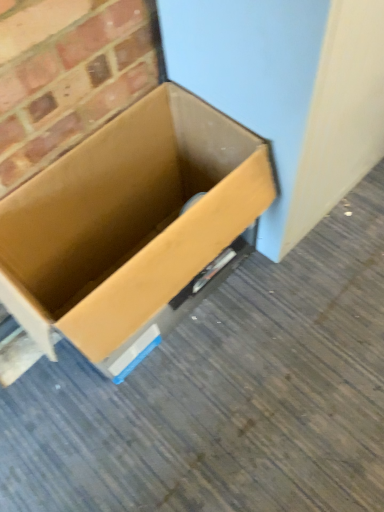
The height and width of the screenshot is (512, 384). What do you see at coordinates (129, 227) in the screenshot?
I see `brown cardboard box at center` at bounding box center [129, 227].

The image size is (384, 512). What are the coordinates of `brown cardboard box at center` in the screenshot? It's located at (129, 227).

The width and height of the screenshot is (384, 512). I want to click on brown cardboard box at center, so click(129, 227).